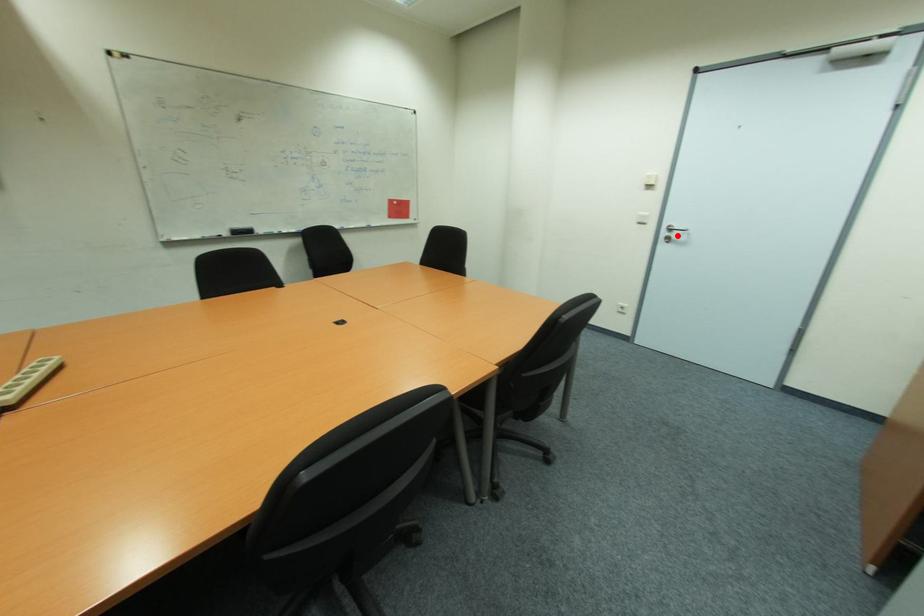
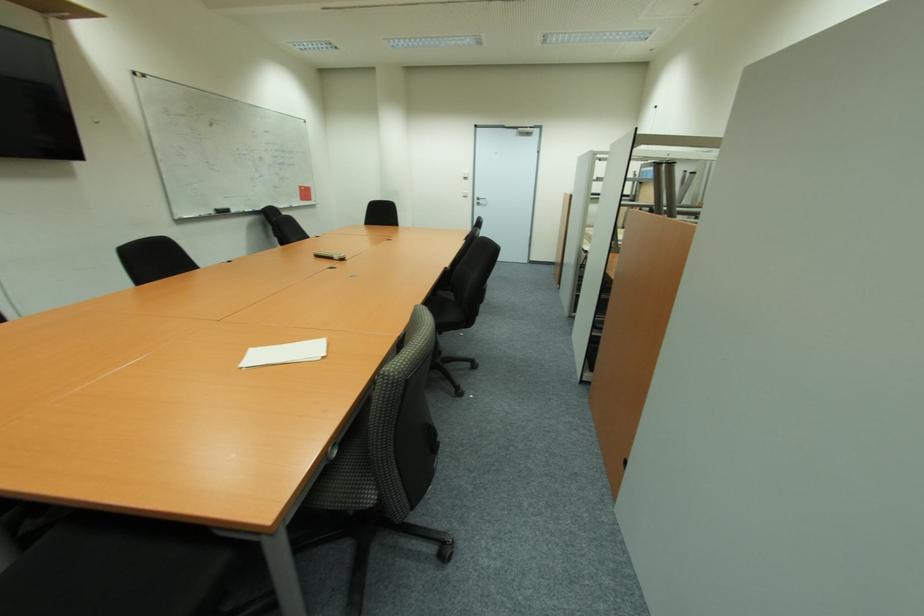
Locate, in the second image, the point that corresponds to the highlighted location in the first image.

(483, 203)